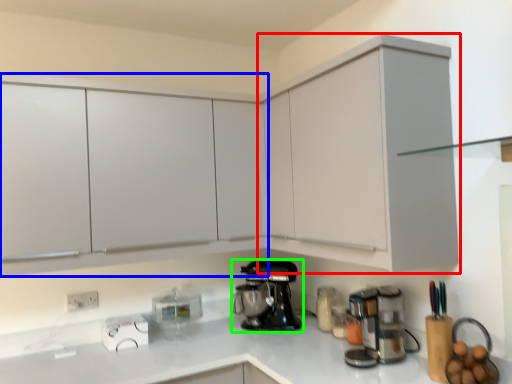
Question: Estimate the real-world distances between objects in this image. Which object is farther from cabinetry (highlighted by a red box), cabinetry (highlighted by a blue box) or kitchen appliance (highlighted by a green box)?

Choices:
 (A) cabinetry
 (B) kitchen appliance

Answer: (A)